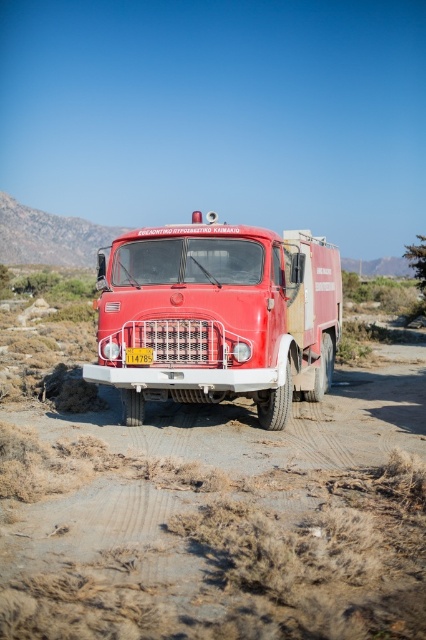
Is point (270, 285) less distant than point (141, 348)?

That is False.

Between point (316, 323) and point (149, 348), which one is positioned behind?

The point (316, 323) is behind.

The image size is (426, 640). I want to click on shiny red fire truck at center, so click(x=218, y=316).

Locate an element on the screen. The image size is (426, 640). shiny red fire truck at center is located at coordinates (218, 316).